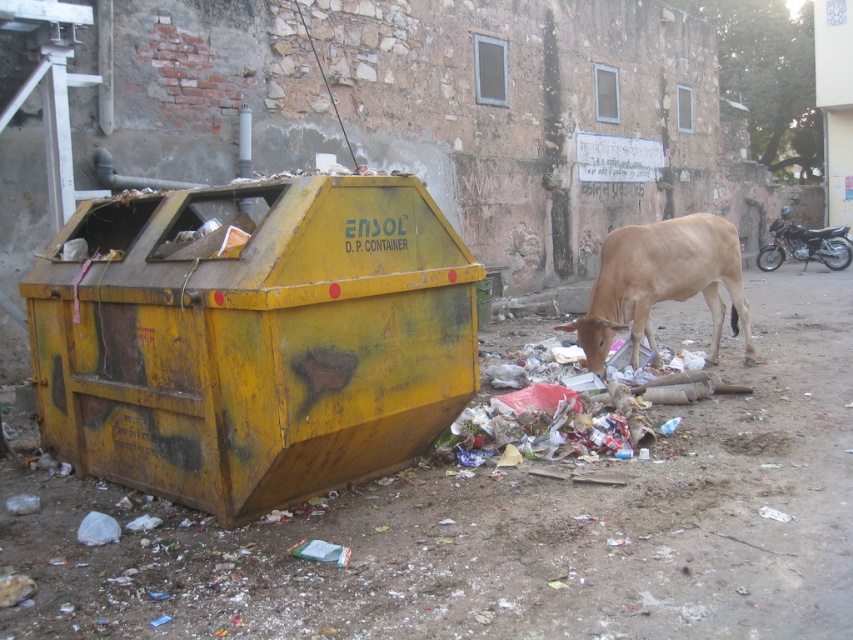
You are a city planner assessing waste management needs. You observe the yellow matte container at left and the light brown cow at center in the scene. Which object occupies more horizontal space in the image?

The yellow matte container at left occupies more horizontal space than the light brown cow at center because its width is larger.

You are standing in the urban scene and see the point at coordinates (253, 339). Which object is this point located on?

The point at coordinates (253, 339) is located on the yellow matte container at left.

You are a city planner analyzing the layout of this urban area. Given the coordinates of the yellow matte container at left, can you determine its position relative to the center of the image?

The yellow matte container at left is located at coordinates point (253, 339), which places it slightly to the left and below the center of the image.